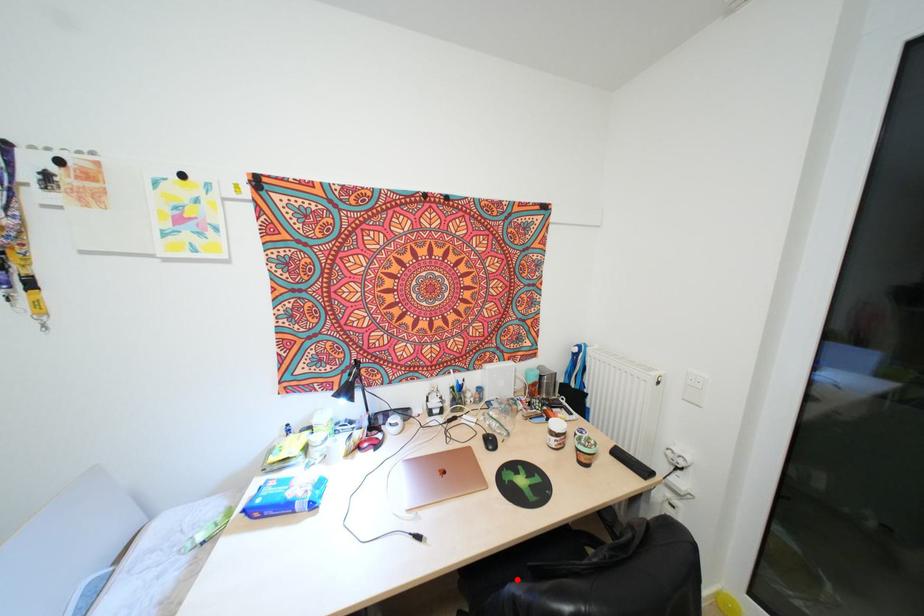
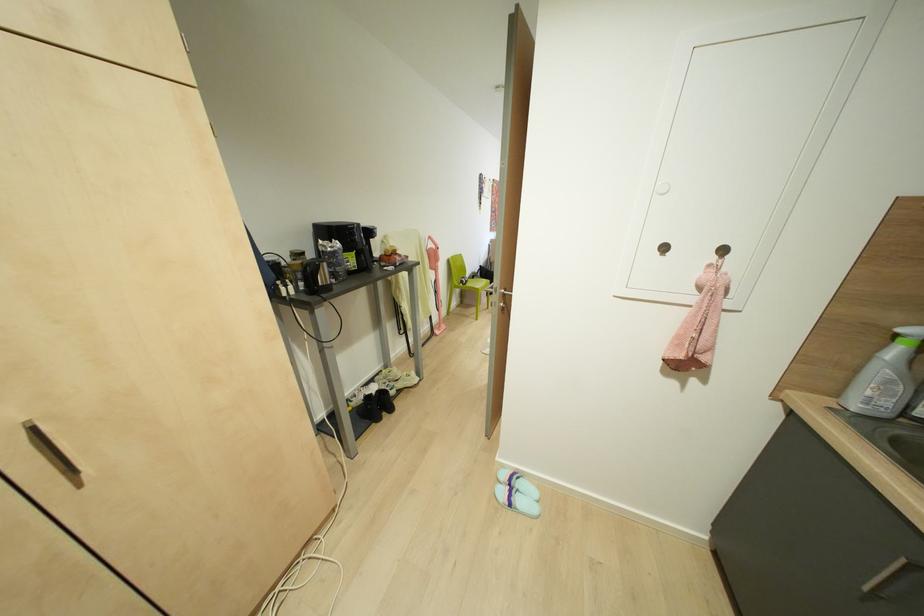
Question: I am providing you with two images of the same scene from different viewpoints. A red point is marked on the first image. Is the red point's position out of view in image 2?

Choices:
 (A) Yes
 (B) No

Answer: (A)